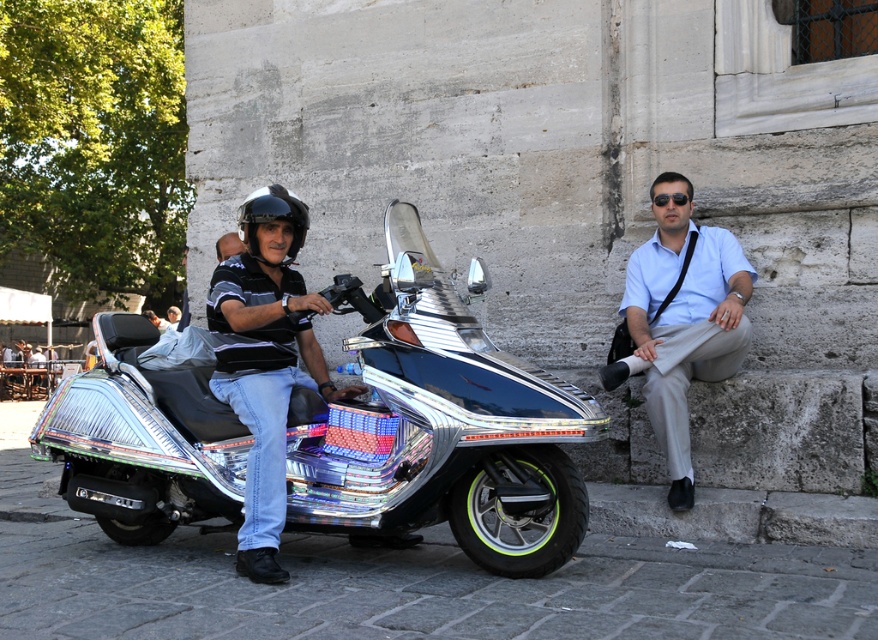
You are a delivery person who needs to hand over a package to the recipient. You see the light blue shirt at right sitting on a stone ledge. Where should you approach to deliver the package?

The light blue shirt at right is located at point [682,317], so you should approach the stone ledge at that coordinate to deliver the package.

You are a pedestrian standing on the sidewalk and see the shiny metallic helmet at upper left and the light blue shirt at right. Which object is closer to your left side?

The shiny metallic helmet at upper left is closer to your left side since it is positioned to the left of the light blue shirt at right.